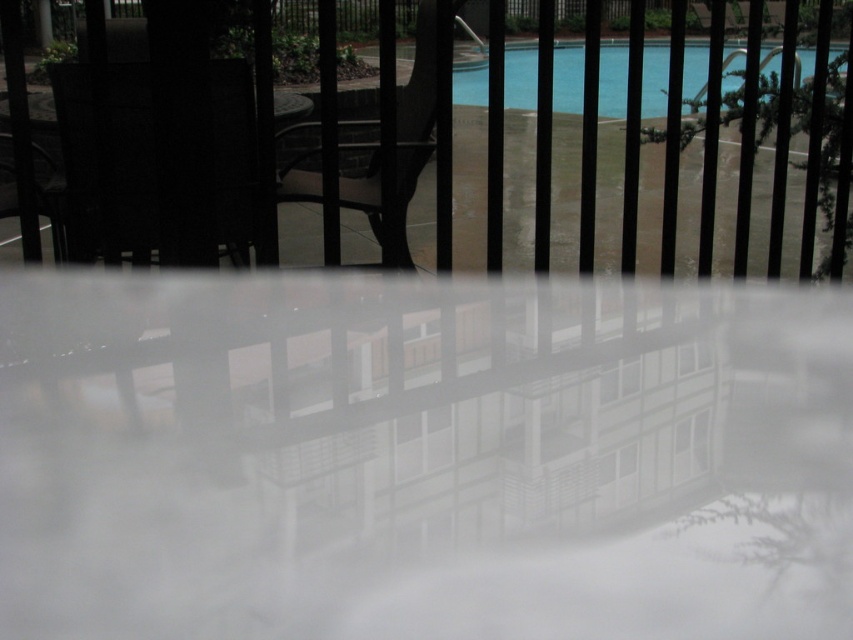
Can you confirm if matte black chair at left is bigger than matte black chair at center?

Actually, matte black chair at left might be smaller than matte black chair at center.

At what (x,y) coordinates should I click in order to perform the action: click on matte black chair at left. Please return your answer as a coordinate pair (x, y). Looking at the image, I should click on (234, 154).

At what (x,y) coordinates should I click in order to perform the action: click on matte black chair at left. Please return your answer as a coordinate pair (x, y). The width and height of the screenshot is (853, 640). Looking at the image, I should click on (234, 154).

Which is below, matte black chair at left or blue glossy water at upper center?

matte black chair at left

Who is more distant from viewer, [70,221] or [610,100]?

The point [610,100] is more distant.

Which is behind, point (221, 195) or point (619, 88)?

Point (619, 88)

Identify the location of matte black chair at left. This screenshot has height=640, width=853. (234, 154).

Does black metal fence at center lie behind matte black chair at left?

No, black metal fence at center is in front of matte black chair at left.

Does point (28, 244) come farther from viewer compared to point (236, 124)?

No, (28, 244) is in front of (236, 124).

Which is in front, point (817, 164) or point (229, 164)?

Point (817, 164) is more forward.

Identify the location of black metal fence at center. Image resolution: width=853 pixels, height=640 pixels. (415, 138).